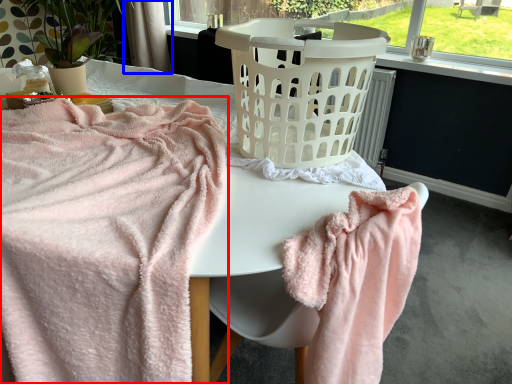
Question: Which object is closer to the camera taking this photo, towel (highlighted by a red box) or curtain (highlighted by a blue box)?

Choices:
 (A) towel
 (B) curtain

Answer: (A)